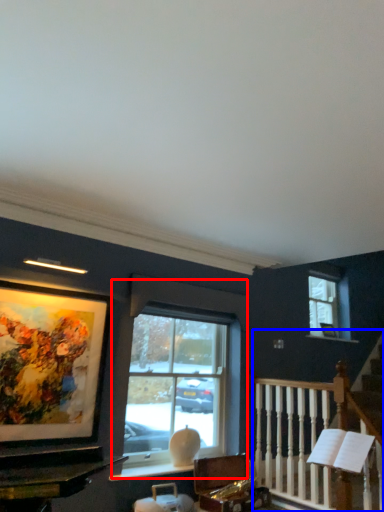
Question: Which of the following is the closest to the observer, window (highlighted by a red box) or rail (highlighted by a blue box)?

Choices:
 (A) window
 (B) rail

Answer: (B)